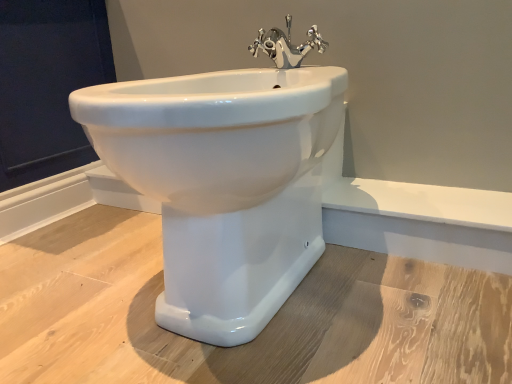
Question: From a real-world perspective, is chrome metallic faucet at upper center above or below dark blue fabric at upper left?

Choices:
 (A) above
 (B) below

Answer: (A)

Question: Would you say chrome metallic faucet at upper center is to the left or to the right of dark blue fabric at upper left in the picture?

Choices:
 (A) left
 (B) right

Answer: (B)

Question: Estimate the real-world distances between objects in this image. Which object is closer to the dark blue fabric at upper left?

Choices:
 (A) chrome metallic faucet at upper center
 (B) white glossy bidet at center

Answer: (A)

Question: Which object is the farthest from the dark blue fabric at upper left?

Choices:
 (A) chrome metallic faucet at upper center
 (B) white glossy bidet at center

Answer: (B)